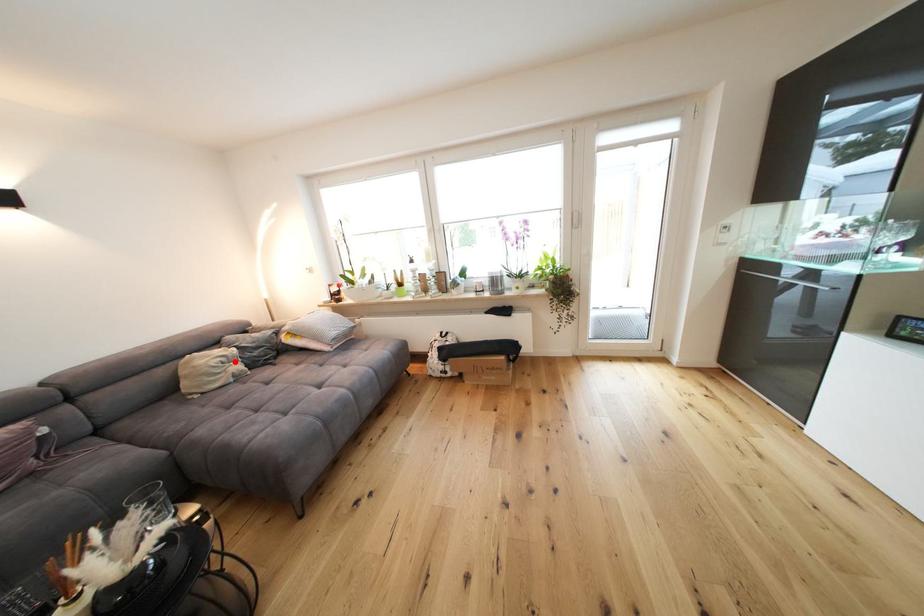
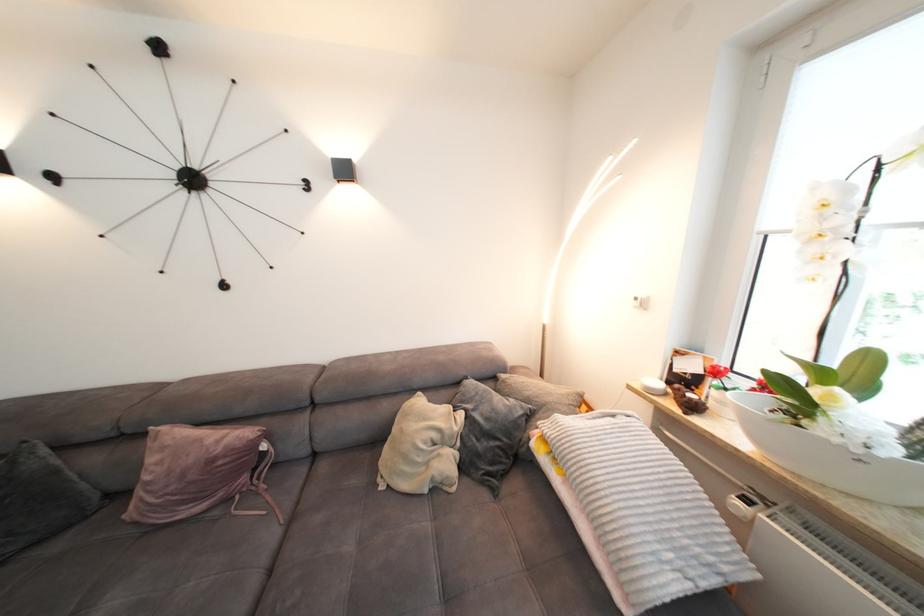
Find the pixel in the second image that matches the highlighted location in the first image.

(450, 440)